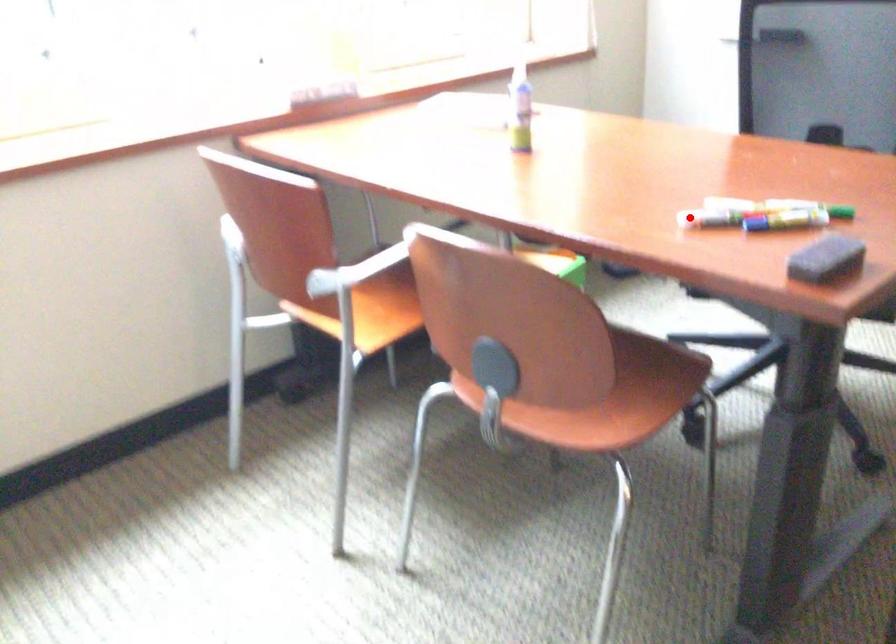
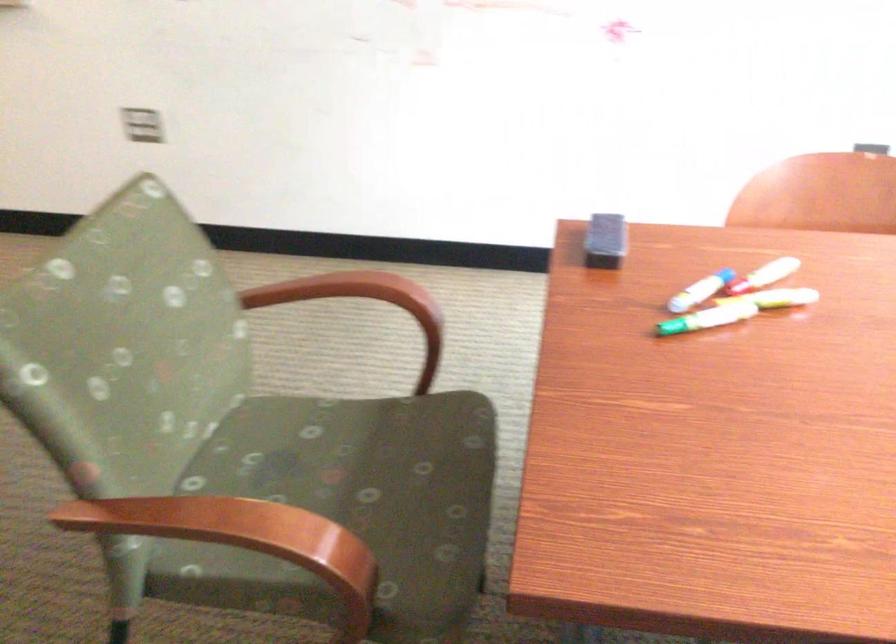
The point at the highlighted location is marked in the first image. Where is the corresponding point in the second image?

(773, 270)